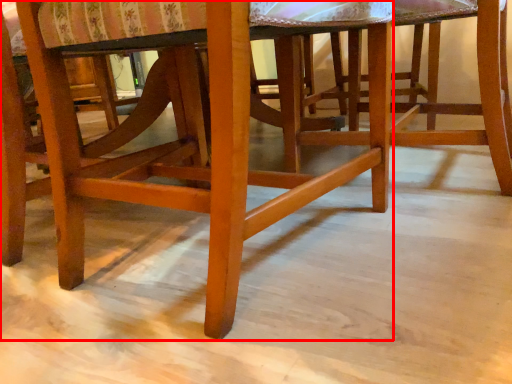
Question: Considering the relative positions of chair (annotated by the red box) and stool in the image provided, where is chair (annotated by the red box) located with respect to the staircase?

Choices:
 (A) left
 (B) right

Answer: (A)